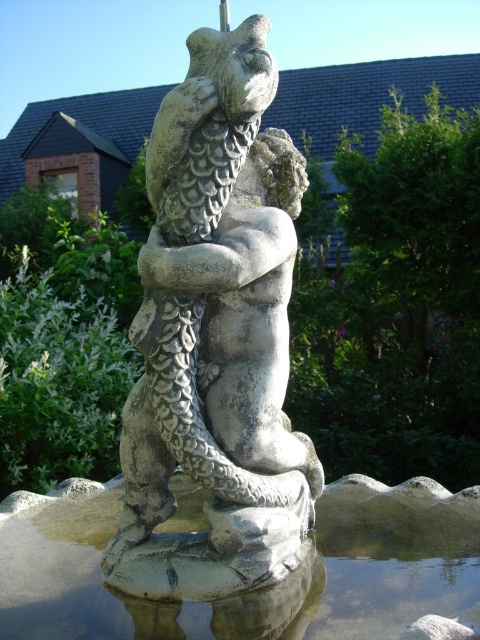
Question: Does gray stone statue at center have a larger size compared to clear stone water at center?

Choices:
 (A) yes
 (B) no

Answer: (B)

Question: Among these points, which one is nearest to the camera?

Choices:
 (A) (265, 604)
 (B) (175, 260)

Answer: (B)

Question: Among these points, which one is farthest from the camera?

Choices:
 (A) (x=97, y=516)
 (B) (x=180, y=208)

Answer: (A)

Question: Does gray stone statue at center appear on the right side of clear stone water at center?

Choices:
 (A) yes
 (B) no

Answer: (A)

Question: Is gray stone statue at center bigger than clear stone water at center?

Choices:
 (A) yes
 (B) no

Answer: (B)

Question: Among these points, which one is farthest from the camera?

Choices:
 (A) (160, 563)
 (B) (233, 115)

Answer: (A)